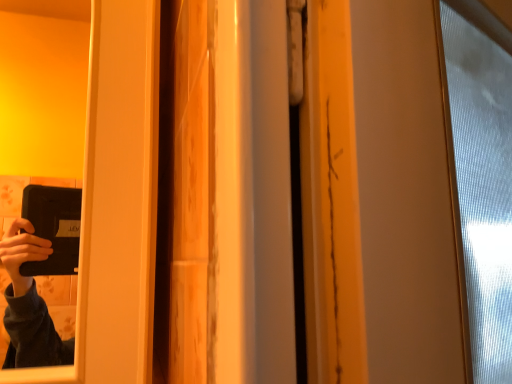
What do you see at coordinates (44, 87) in the screenshot?
I see `transparent glass train window at left` at bounding box center [44, 87].

Where is `transparent glass train window at left`? Image resolution: width=512 pixels, height=384 pixels. transparent glass train window at left is located at coordinates (44, 87).

Measure the distance between point (x=61, y=104) and camera.

The distance of point (x=61, y=104) from camera is 1.58 meters.

Measure the distance between transparent glass train window at left and camera.

The distance of transparent glass train window at left from camera is 1.14 meters.

What is the approximate height of transparent glass train window at left?

transparent glass train window at left is 28.48 inches tall.

The width and height of the screenshot is (512, 384). Identify the location of transparent glass train window at left. (44, 87).